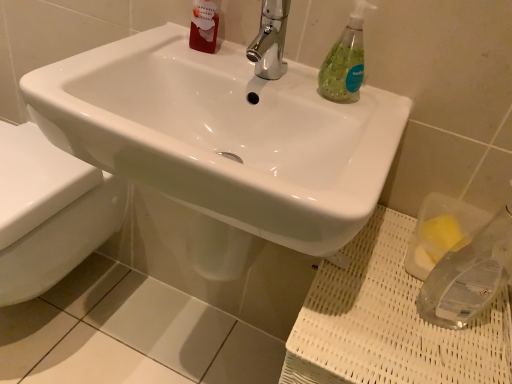
The height and width of the screenshot is (384, 512). In order to click on vacant position to the left of translucent red liquid at upper left in this screenshot , I will do `click(157, 46)`.